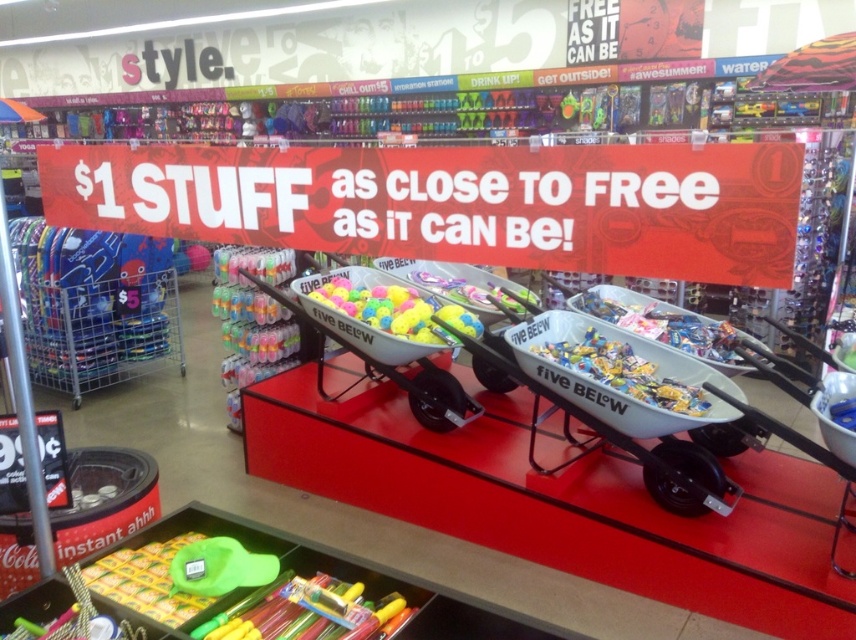
Between white plastic wheelbarrow at center and matte plastic balls at center, which one is positioned higher?

matte plastic balls at center is higher up.

Is white plastic wheelbarrow at center below matte plastic balls at center?

Correct, white plastic wheelbarrow at center is located below matte plastic balls at center.

Who is more distant from viewer, (411, 385) or (343, 307)?

The point (411, 385) is behind.

At what (x,y) coordinates should I click in order to perform the action: click on white plastic wheelbarrow at center. Please return your answer as a coordinate pair (x, y). This screenshot has height=640, width=856. Looking at the image, I should click on (611, 433).